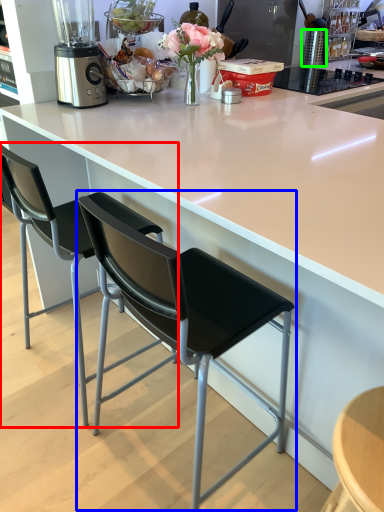
Question: Estimate the real-world distances between objects in this image. Which object is closer to chair (highlighted by a red box), chair (highlighted by a blue box) or kitchen appliance (highlighted by a green box)?

Choices:
 (A) chair
 (B) kitchen appliance

Answer: (A)